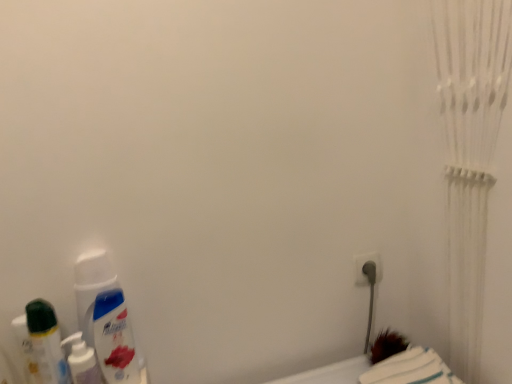
The width and height of the screenshot is (512, 384). Identify the location of white soft towel at lower right. (411, 369).

Describe the element at coordinates (362, 266) in the screenshot. The height and width of the screenshot is (384, 512). I see `white plastic plug at lower right` at that location.

Where is `white glossy mouthwash at lower left, which is the 2th mouthwash in right-to-left order`? This screenshot has width=512, height=384. white glossy mouthwash at lower left, which is the 2th mouthwash in right-to-left order is located at coordinates (82, 361).

What do you see at coordinates (46, 342) in the screenshot? This screenshot has width=512, height=384. I see `translucent plastic mouthwash at lower left, arranged as the third mouthwash when viewed from the right` at bounding box center [46, 342].

Where is `white soft towel at lower right`? Image resolution: width=512 pixels, height=384 pixels. white soft towel at lower right is located at coordinates (411, 369).

Who is taller, white soft towel at lower right or translucent plastic mouthwash at lower left, arranged as the third mouthwash when viewed from the right?

With more height is translucent plastic mouthwash at lower left, arranged as the third mouthwash when viewed from the right.

There is a white soft towel at lower right. Identify the location of the 2nd mouthwash above it (from the image's perspective). (46, 342).

Is white soft towel at lower right not within translucent plastic mouthwash at lower left, which appears as the first mouthwash when viewed from the left?

Indeed, white soft towel at lower right is completely outside translucent plastic mouthwash at lower left, which appears as the first mouthwash when viewed from the left.

What's the angular difference between white soft towel at lower right and translucent plastic mouthwash at lower left, arranged as the third mouthwash when viewed from the right,'s facing directions?

0.591 degrees separate the facing orientations of white soft towel at lower right and translucent plastic mouthwash at lower left, arranged as the third mouthwash when viewed from the right.

Does white glossy mouthwash at lower left, which appears as the third mouthwash when viewed from the left, appear on the left side of white plastic plug at lower right?

Yes, white glossy mouthwash at lower left, which appears as the third mouthwash when viewed from the left, is to the left of white plastic plug at lower right.

Is white plastic plug at lower right located within white glossy mouthwash at lower left, which appears as the third mouthwash when viewed from the left?

No, white plastic plug at lower right is located outside of white glossy mouthwash at lower left, which appears as the third mouthwash when viewed from the left.

Considering the sizes of objects white glossy mouthwash at lower left, which ranks as the 1th mouthwash in right-to-left order, and white plastic plug at lower right in the image provided, who is shorter, white glossy mouthwash at lower left, which ranks as the 1th mouthwash in right-to-left order, or white plastic plug at lower right?

With less height is white plastic plug at lower right.

Is white glossy mouthwash at lower left, which ranks as the 1th mouthwash in right-to-left order, not near white plastic plug at lower right?

No, there isn't a large distance between white glossy mouthwash at lower left, which ranks as the 1th mouthwash in right-to-left order, and white plastic plug at lower right.

Is white soft towel at lower right far from white glossy mouthwash at lower left, which ranks as the 1th mouthwash in right-to-left order?

They are positioned close to each other.

Which of these two, white soft towel at lower right or white glossy mouthwash at lower left, which appears as the third mouthwash when viewed from the left, stands shorter?

Standing shorter between the two is white soft towel at lower right.

Which is in front, white soft towel at lower right or white glossy mouthwash at lower left, which appears as the third mouthwash when viewed from the left?

Positioned in front is white soft towel at lower right.

From the image's perspective, is white soft towel at lower right on top of white glossy mouthwash at lower left, which appears as the third mouthwash when viewed from the left?

No.

Can you tell me how much translucent plastic mouthwash at lower left, arranged as the third mouthwash when viewed from the right, and white glossy mouthwash at lower left, which ranks as the 1th mouthwash in right-to-left order, differ in facing direction?

The facing directions of translucent plastic mouthwash at lower left, arranged as the third mouthwash when viewed from the right, and white glossy mouthwash at lower left, which ranks as the 1th mouthwash in right-to-left order, are 17.1 degrees apart.

Is translucent plastic mouthwash at lower left, arranged as the third mouthwash when viewed from the right, to the right of white glossy mouthwash at lower left, which appears as the third mouthwash when viewed from the left, from the viewer's perspective?

No, translucent plastic mouthwash at lower left, arranged as the third mouthwash when viewed from the right, is not to the right of white glossy mouthwash at lower left, which appears as the third mouthwash when viewed from the left.

Between translucent plastic mouthwash at lower left, which appears as the first mouthwash when viewed from the left, and white glossy mouthwash at lower left, which ranks as the 1th mouthwash in right-to-left order, which one has smaller width?

With smaller width is white glossy mouthwash at lower left, which ranks as the 1th mouthwash in right-to-left order.

From a real-world perspective, who is located higher, translucent plastic mouthwash at lower left, which appears as the first mouthwash when viewed from the left, or white glossy mouthwash at lower left, which ranks as the 1th mouthwash in right-to-left order?

translucent plastic mouthwash at lower left, which appears as the first mouthwash when viewed from the left.

Can you confirm if white plastic plug at lower right is positioned to the right of white glossy mouthwash at lower left, which is the second mouthwash from left to right?

Yes.

Is white plastic plug at lower right bigger or smaller than white glossy mouthwash at lower left, which is the second mouthwash from left to right?

Clearly, white plastic plug at lower right is smaller in size than white glossy mouthwash at lower left, which is the second mouthwash from left to right.

Which is correct: white plastic plug at lower right is inside white glossy mouthwash at lower left, which is the second mouthwash from left to right, or outside of it?

white plastic plug at lower right is located beyond the bounds of white glossy mouthwash at lower left, which is the second mouthwash from left to right.

Can you confirm if white plastic plug at lower right is wider than white glossy mouthwash at lower left, which ranks as the 1th mouthwash in right-to-left order?

Incorrect, the width of white plastic plug at lower right does not surpass that of white glossy mouthwash at lower left, which ranks as the 1th mouthwash in right-to-left order.

Locate an element on the screen. Image resolution: width=512 pixels, height=384 pixels. power plugs and sockets below the white glossy mouthwash at lower left, which ranks as the 1th mouthwash in right-to-left order (from a real-world perspective) is located at coordinates (362, 266).

Which object is positioned more to the right, white plastic plug at lower right or white glossy mouthwash at lower left, which ranks as the 1th mouthwash in right-to-left order?

white plastic plug at lower right is more to the right.

How much distance is there between white plastic plug at lower right and white glossy mouthwash at lower left, which ranks as the 1th mouthwash in right-to-left order?

white plastic plug at lower right and white glossy mouthwash at lower left, which ranks as the 1th mouthwash in right-to-left order, are 23.99 inches apart.

Considering the relative positions of white glossy mouthwash at lower left, which appears as the third mouthwash when viewed from the left, and translucent plastic mouthwash at lower left, arranged as the third mouthwash when viewed from the right, in the image provided, is white glossy mouthwash at lower left, which appears as the third mouthwash when viewed from the left, in front of translucent plastic mouthwash at lower left, arranged as the third mouthwash when viewed from the right,?

No, white glossy mouthwash at lower left, which appears as the third mouthwash when viewed from the left, is further to the viewer.

Is white glossy mouthwash at lower left, which ranks as the 1th mouthwash in right-to-left order, oriented away from translucent plastic mouthwash at lower left, arranged as the third mouthwash when viewed from the right?

white glossy mouthwash at lower left, which ranks as the 1th mouthwash in right-to-left order, does not have its back to translucent plastic mouthwash at lower left, arranged as the third mouthwash when viewed from the right.

In terms of width, does white glossy mouthwash at lower left, which ranks as the 1th mouthwash in right-to-left order, look wider or thinner when compared to translucent plastic mouthwash at lower left, which appears as the first mouthwash when viewed from the left?

In the image, white glossy mouthwash at lower left, which ranks as the 1th mouthwash in right-to-left order, appears to be more narrow than translucent plastic mouthwash at lower left, which appears as the first mouthwash when viewed from the left.

Measure the distance from white glossy mouthwash at lower left, which ranks as the 1th mouthwash in right-to-left order, to translucent plastic mouthwash at lower left, which appears as the first mouthwash when viewed from the left.

3.81 inches.

From a real-world perspective, which mouthwash is the 3rd one above the white soft towel at lower right? Please provide its 2D coordinates.

[(46, 342)]

Locate an element on the screen. This screenshot has width=512, height=384. power plugs and sockets behind the white glossy mouthwash at lower left, which ranks as the 1th mouthwash in right-to-left order is located at coordinates (362, 266).

Considering their positions, is translucent plastic mouthwash at lower left, arranged as the third mouthwash when viewed from the right, positioned further to white soft towel at lower right than white glossy mouthwash at lower left, which is the second mouthwash from left to right?

translucent plastic mouthwash at lower left, arranged as the third mouthwash when viewed from the right.

Estimate the real-world distances between objects in this image. Which object is further from translucent plastic mouthwash at lower left, which appears as the first mouthwash when viewed from the left, white plastic plug at lower right or white soft towel at lower right?

white plastic plug at lower right.

From the image, which object appears to be nearer to white glossy mouthwash at lower left, which is the 2th mouthwash in right-to-left order, white glossy mouthwash at lower left, which ranks as the 1th mouthwash in right-to-left order, or white plastic plug at lower right?

white glossy mouthwash at lower left, which ranks as the 1th mouthwash in right-to-left order.

Considering their positions, is white plastic plug at lower right positioned further to white glossy mouthwash at lower left, which ranks as the 1th mouthwash in right-to-left order, than white soft towel at lower right?

Based on the image, white plastic plug at lower right appears to be further to white glossy mouthwash at lower left, which ranks as the 1th mouthwash in right-to-left order.

Based on their spatial positions, is white soft towel at lower right or translucent plastic mouthwash at lower left, which appears as the first mouthwash when viewed from the left, closer to white glossy mouthwash at lower left, which ranks as the 1th mouthwash in right-to-left order?

The object closer to white glossy mouthwash at lower left, which ranks as the 1th mouthwash in right-to-left order, is translucent plastic mouthwash at lower left, which appears as the first mouthwash when viewed from the left.

In the scene shown: Estimate the real-world distances between objects in this image. Which object is further from white soft towel at lower right, white plastic plug at lower right or translucent plastic mouthwash at lower left, which appears as the first mouthwash when viewed from the left?

translucent plastic mouthwash at lower left, which appears as the first mouthwash when viewed from the left.

Looking at the image, which one is located further to white soft towel at lower right, white plastic plug at lower right or white glossy mouthwash at lower left, which is the second mouthwash from left to right?

Based on the image, white glossy mouthwash at lower left, which is the second mouthwash from left to right, appears to be further to white soft towel at lower right.

Which object lies further to the anchor point translucent plastic mouthwash at lower left, arranged as the third mouthwash when viewed from the right, white glossy mouthwash at lower left, which is the 2th mouthwash in right-to-left order, or white plastic plug at lower right?

The object further to translucent plastic mouthwash at lower left, arranged as the third mouthwash when viewed from the right, is white plastic plug at lower right.

Where is `mouthwash situated between translucent plastic mouthwash at lower left, arranged as the third mouthwash when viewed from the right, and white glossy mouthwash at lower left, which ranks as the 1th mouthwash in right-to-left order, from left to right`? mouthwash situated between translucent plastic mouthwash at lower left, arranged as the third mouthwash when viewed from the right, and white glossy mouthwash at lower left, which ranks as the 1th mouthwash in right-to-left order, from left to right is located at coordinates (82, 361).

The height and width of the screenshot is (384, 512). Identify the location of power plugs and sockets between translucent plastic mouthwash at lower left, arranged as the third mouthwash when viewed from the right, and white soft towel at lower right from left to right. (362, 266).

The width and height of the screenshot is (512, 384). In order to click on power plugs and sockets between white glossy mouthwash at lower left, which is the second mouthwash from left to right, and white soft towel at lower right from left to right in this screenshot , I will do `click(362, 266)`.

At what (x,y) coordinates should I click in order to perform the action: click on mouthwash located between white glossy mouthwash at lower left, which is the 2th mouthwash in right-to-left order, and white plastic plug at lower right in the left-right direction. Please return your answer as a coordinate pair (x, y). Image resolution: width=512 pixels, height=384 pixels. Looking at the image, I should click on (114, 339).